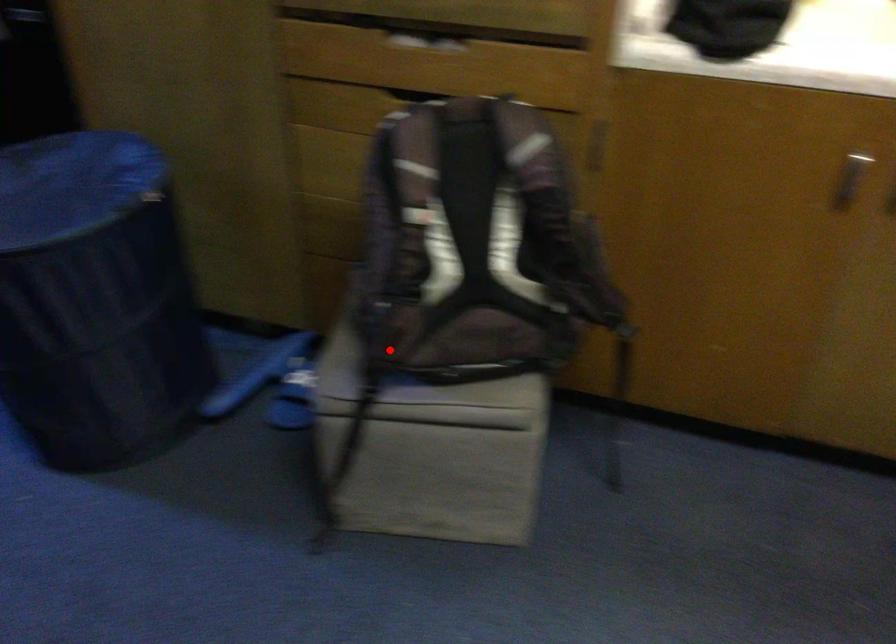
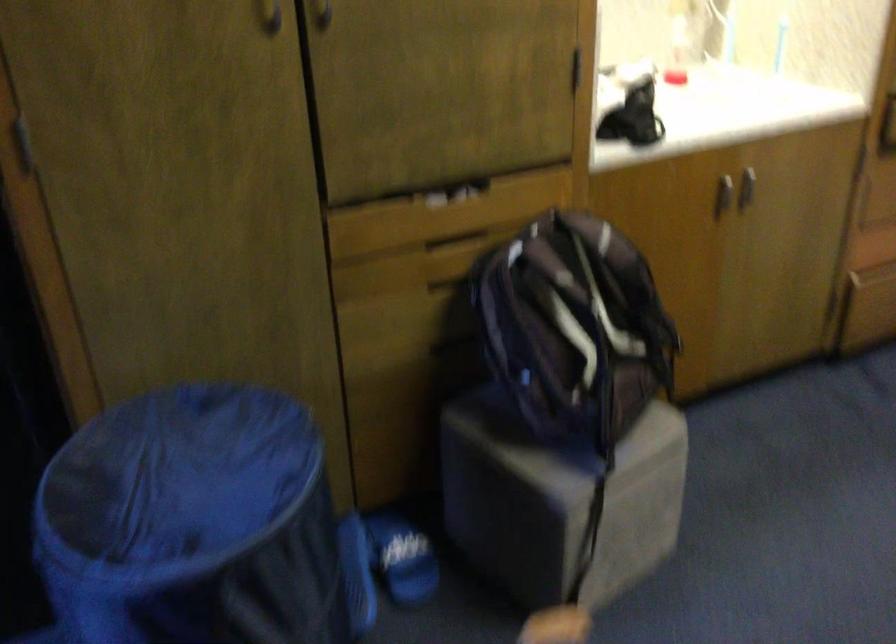
Where in the second image is the point corresponding to the highlighted location from the first image?

(556, 442)